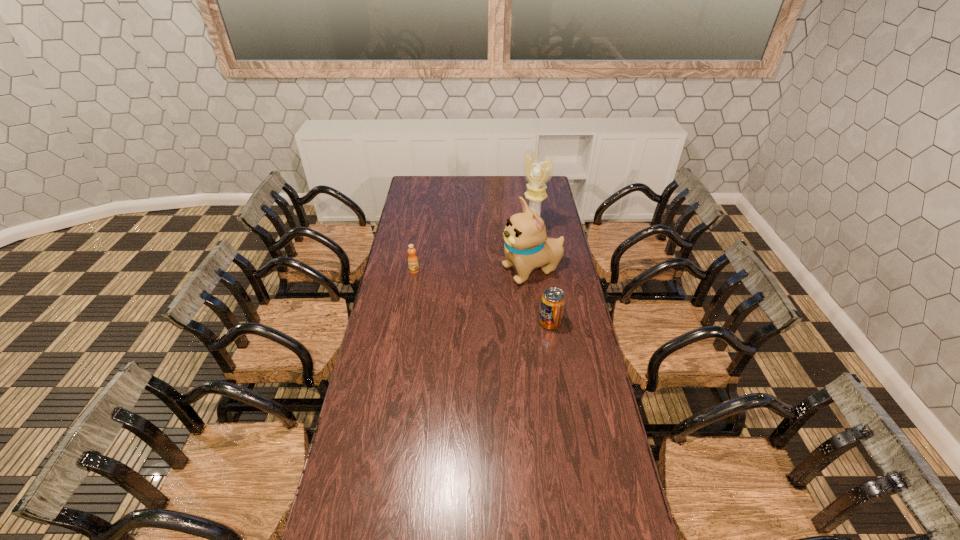
Locate an element on the screen. The width and height of the screenshot is (960, 540). free space between the leftmost object and the puppy is located at coordinates (473, 271).

This screenshot has width=960, height=540. In order to click on free point between the farthest object and the leftmost object in this screenshot , I will do `click(473, 251)`.

Locate an element on the screen. free area in between the leftmost object and the award is located at coordinates (473, 251).

At what (x,y) coordinates should I click in order to perform the action: click on vacant space in between the award and the leftmost object. Please return your answer as a coordinate pair (x, y). Looking at the image, I should click on (473, 251).

This screenshot has width=960, height=540. Identify the location of empty location between the farthest object and the leftmost object. (473, 251).

Find the location of a particular element. unoccupied position between the nearest object and the orange juice is located at coordinates (482, 296).

The width and height of the screenshot is (960, 540). What are the coordinates of `empty space that is in between the orange juice and the third shortest object` in the screenshot? It's located at (473, 271).

What are the coordinates of `vacant region between the nearest object and the puppy` in the screenshot? It's located at (541, 297).

This screenshot has width=960, height=540. Find the location of `vacant space that's between the leftmost object and the puppy`. vacant space that's between the leftmost object and the puppy is located at coordinates (473, 271).

This screenshot has width=960, height=540. I want to click on vacant area that lies between the puppy and the soda can, so click(x=541, y=297).